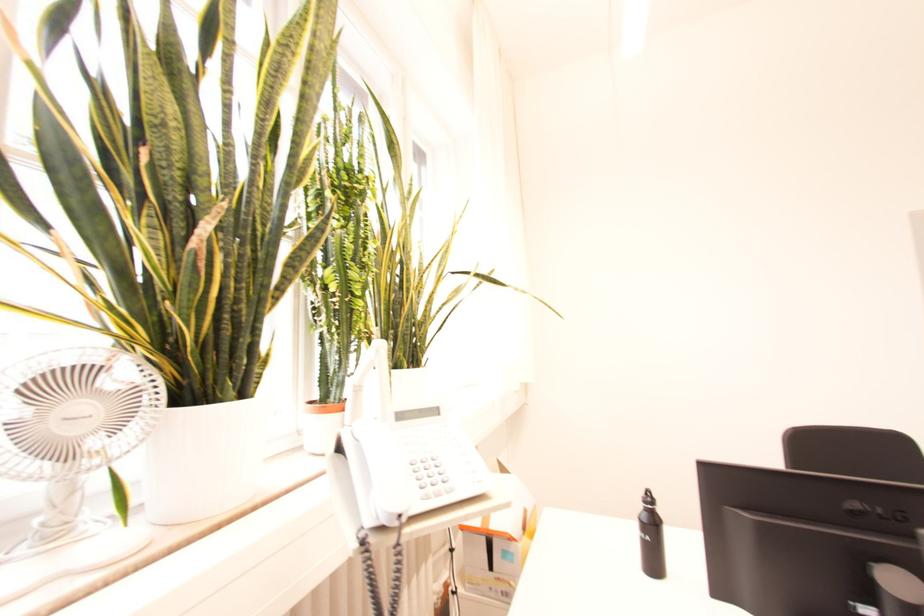
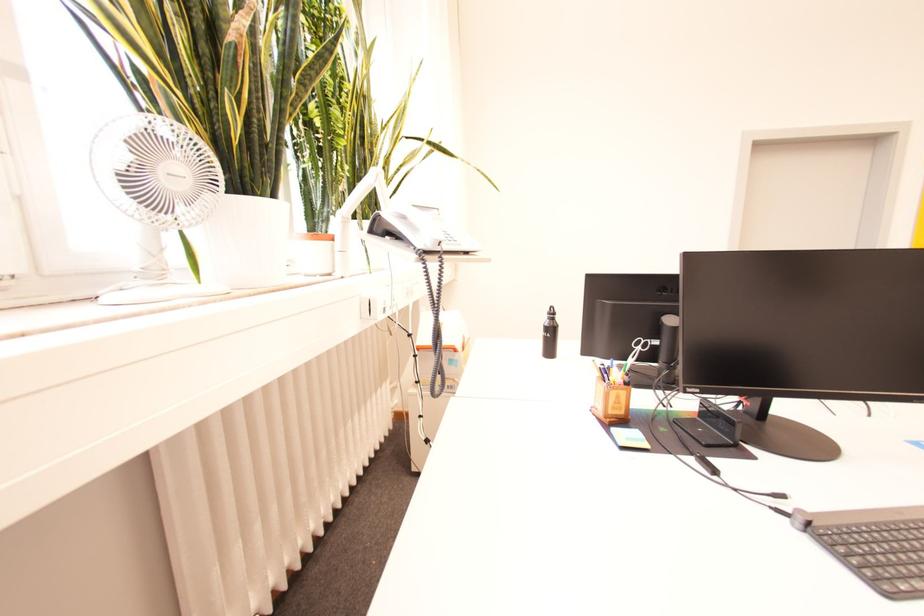
How did the camera likely rotate?

The rotation direction of the camera is right-down.